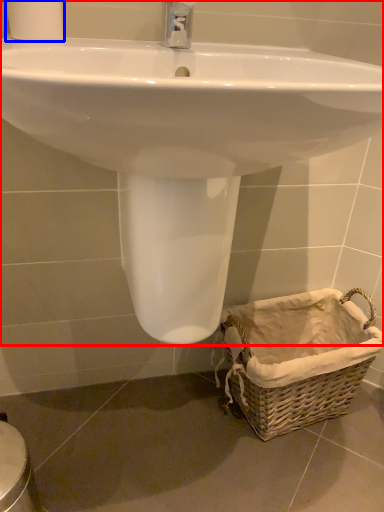
Question: Which object is further to the camera taking this photo, sink (highlighted by a red box) or toilet paper (highlighted by a blue box)?

Choices:
 (A) sink
 (B) toilet paper

Answer: (B)